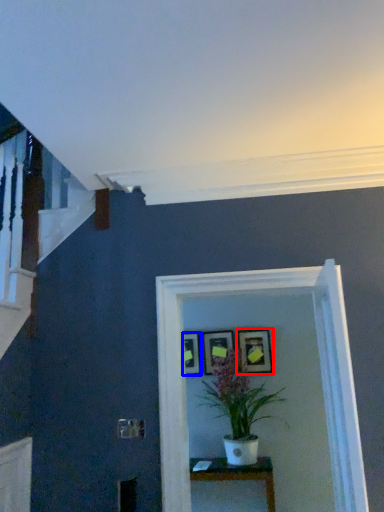
Question: Which object is closer to the camera taking this photo, picture frame (highlighted by a red box) or picture frame (highlighted by a blue box)?

Choices:
 (A) picture frame
 (B) picture frame

Answer: (A)